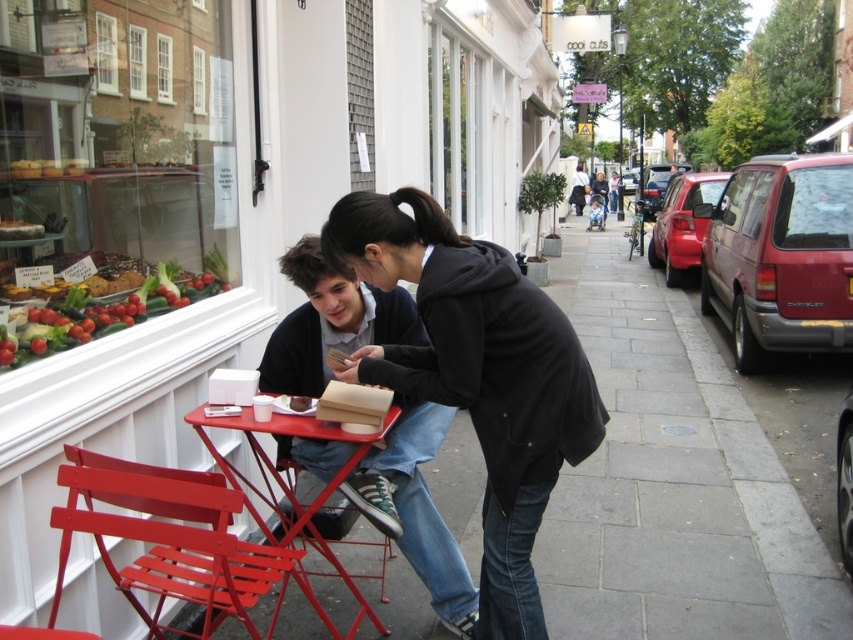
Question: Which of these objects is positioned closest to the fresh green leafy vegetables at left?

Choices:
 (A) black matte jacket at center
 (B) metallic red table at center
 (C) matte black table at center
 (D) metallic red chair at lower center

Answer: (B)

Question: Does black matte jacket at center appear under metallic red table at center?

Choices:
 (A) yes
 (B) no

Answer: (B)

Question: Which point is farther to the camera?

Choices:
 (A) (309, 72)
 (B) (10, 358)
 (C) (148, 586)

Answer: (A)

Question: Is metallic red chair at lower left thinner than fresh green leafy vegetables at left?

Choices:
 (A) no
 (B) yes

Answer: (A)

Question: Is matte black table at center bigger than metallic red table at center?

Choices:
 (A) no
 (B) yes

Answer: (B)

Question: Which point is farther from the camera taking this photo?

Choices:
 (A) (283, 467)
 (B) (508, 378)

Answer: (A)